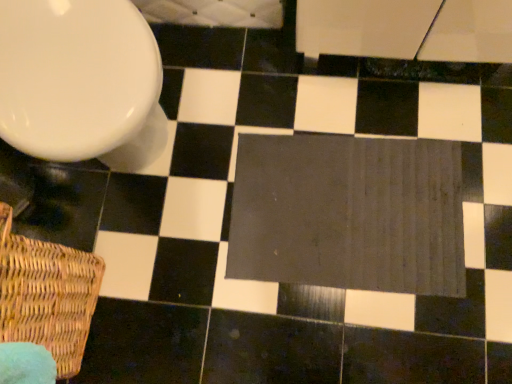
Where is `vacant area that lies between woven brown basket at lower left and dark gray fabric bath mat at center`? The height and width of the screenshot is (384, 512). vacant area that lies between woven brown basket at lower left and dark gray fabric bath mat at center is located at coordinates (199, 280).